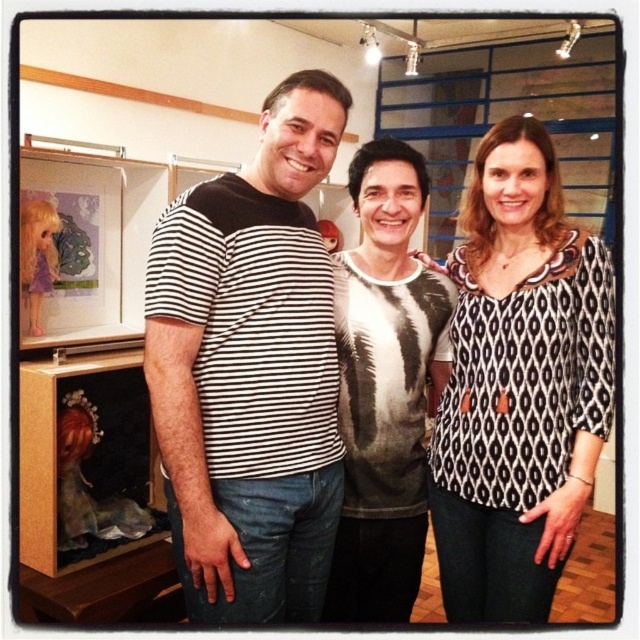
Question: Which of the following is the closest to the observer?

Choices:
 (A) pos(385,541)
 (B) pos(545,429)

Answer: (B)

Question: Is striped cotton t-shirt at center closer to the viewer compared to black printed blouse at center?

Choices:
 (A) yes
 (B) no

Answer: (A)

Question: Which of these objects is positioned closest to the black printed blouse at center?

Choices:
 (A) printed cotton shirt at center
 (B) striped cotton t-shirt at center

Answer: (A)

Question: Observing the image, what is the correct spatial positioning of striped cotton t-shirt at center in reference to black printed blouse at center?

Choices:
 (A) above
 (B) below

Answer: (A)

Question: Is striped cotton t-shirt at center smaller than printed cotton shirt at center?

Choices:
 (A) yes
 (B) no

Answer: (B)

Question: Which point is farther to the camera?

Choices:
 (A) striped cotton t-shirt at center
 (B) black printed blouse at center
 (C) printed cotton shirt at center

Answer: (C)